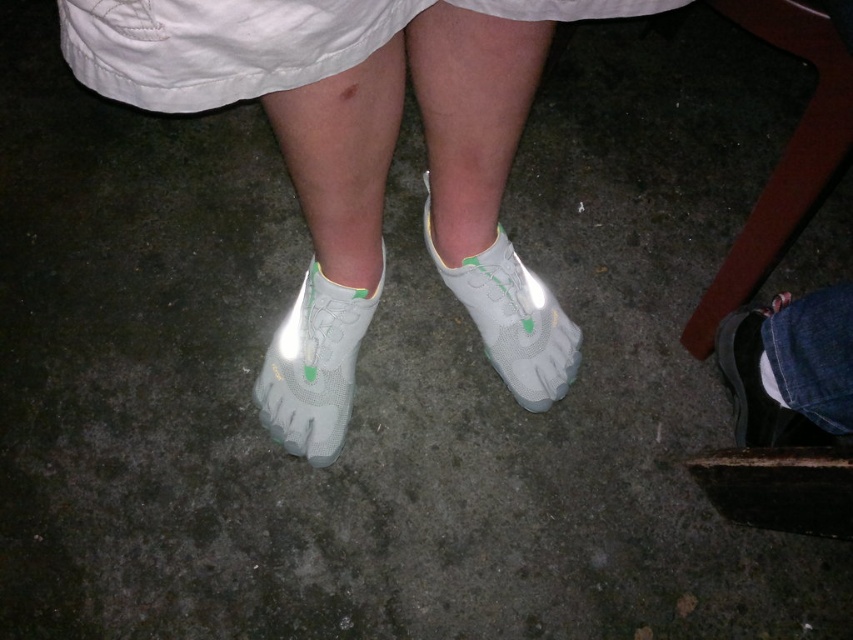
Question: Can you confirm if white cotton dress at upper center is positioned to the left of white mesh shoe at center?

Choices:
 (A) yes
 (B) no

Answer: (A)

Question: Estimate the real-world distances between objects in this image. Which object is farther from the white mesh socks at center?

Choices:
 (A) denim pants at lower right
 (B) white mesh glove at lower center
 (C) white mesh shoe at center
 (D) matte black shoe at lower right

Answer: (D)

Question: Which of the following is the farthest from the observer?

Choices:
 (A) white mesh shoe at center
 (B) white mesh sock at lower right
 (C) matte black shoe at lower right
 (D) white mesh socks at center

Answer: (A)

Question: Can you confirm if white cotton dress at upper center is thinner than white mesh shoe at center?

Choices:
 (A) no
 (B) yes

Answer: (A)

Question: Is denim pants at lower right behind white mesh glove at lower center?

Choices:
 (A) yes
 (B) no

Answer: (B)

Question: Considering the real-world distances, which object is closest to the white mesh shoe at center?

Choices:
 (A) white mesh socks at center
 (B) denim pants at lower right
 (C) white cotton dress at upper center

Answer: (A)